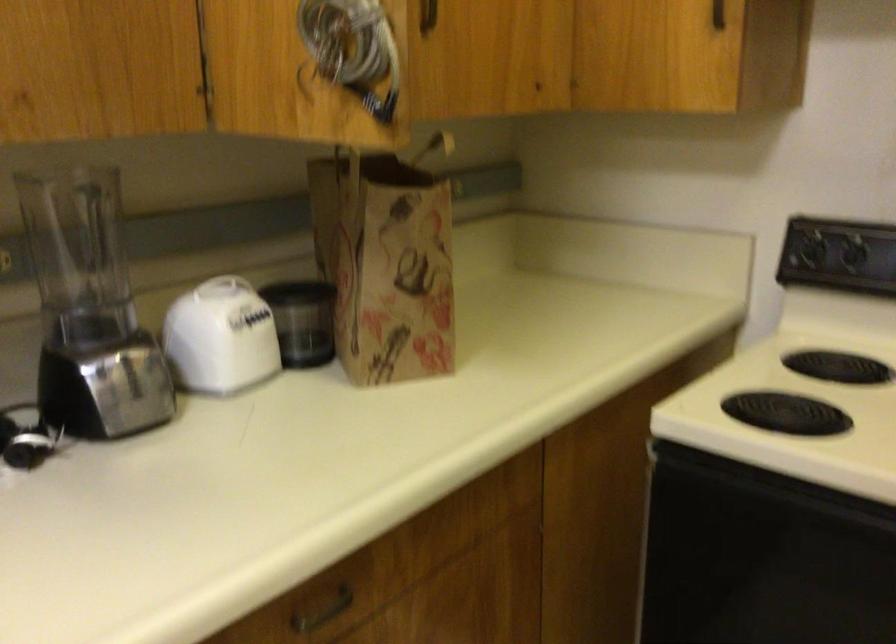
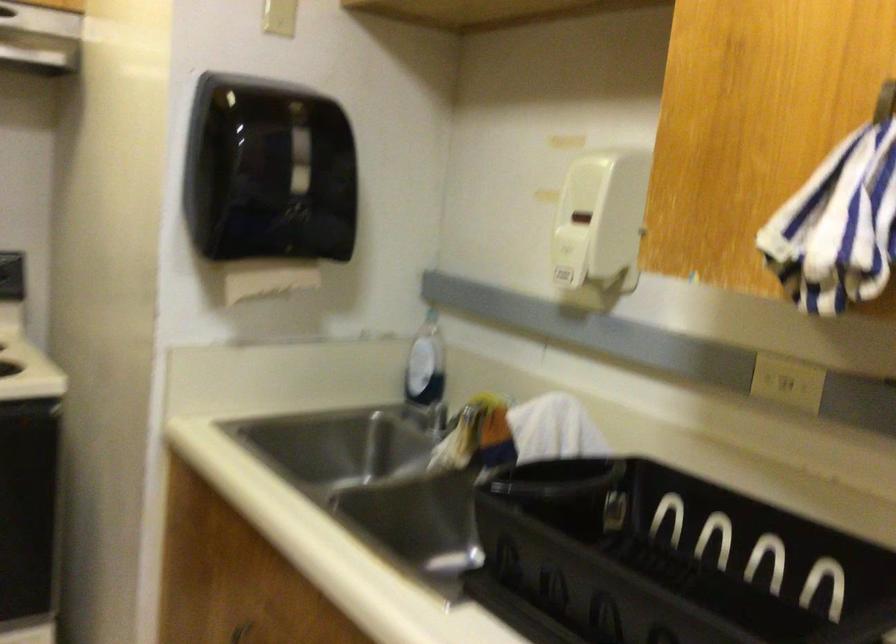
Question: The camera is either moving clockwise (left) or counter-clockwise (right) around the object. The first image is from the beginning of the video and the second image is from the end. Is the camera moving left or right when shooting the video?

Choices:
 (A) Left
 (B) Right

Answer: (A)